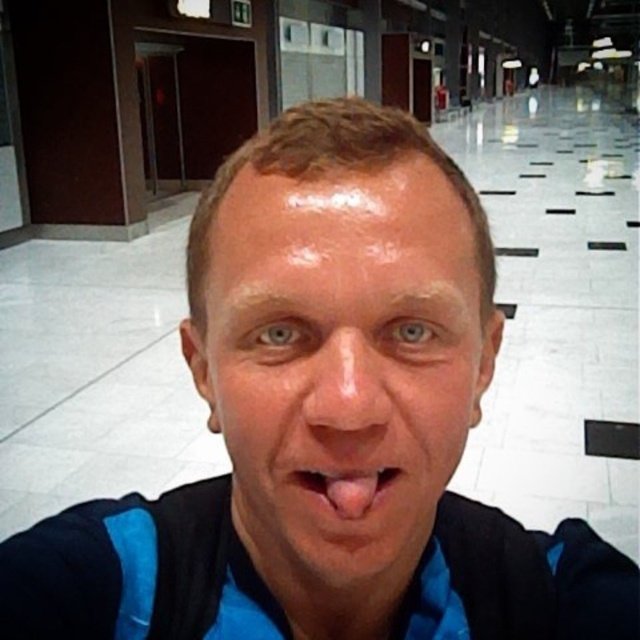
Can you confirm if smooth skin nose at center is bigger than pink flesh at center?

Yes, smooth skin nose at center is bigger than pink flesh at center.

Can you confirm if smooth skin nose at center is taller than pink flesh at center?

Yes.

Find the location of a particular element. This screenshot has width=640, height=640. smooth skin nose at center is located at coordinates (346, 388).

Is smooth skin face at center closer to camera compared to pink flesh at center?

Yes, it is in front of pink flesh at center.

Which of these two, smooth skin face at center or pink flesh at center, stands taller?

Standing taller between the two is smooth skin face at center.

Who is more distant from viewer, (257, 465) or (310, 470)?

Point (257, 465)

Identify the location of smooth skin face at center. The height and width of the screenshot is (640, 640). (340, 364).

Is smooth skin face at center taller than smooth skin nose at center?

Yes, smooth skin face at center is taller than smooth skin nose at center.

Who is more forward, (x=268, y=308) or (x=380, y=369)?

Positioned in front is point (x=380, y=369).

Is point (365, 340) closer to viewer compared to point (336, 433)?

No, (365, 340) is further to viewer.

At what (x,y) coordinates should I click in order to perform the action: click on smooth skin face at center. Please return your answer as a coordinate pair (x, y). Looking at the image, I should click on 340,364.